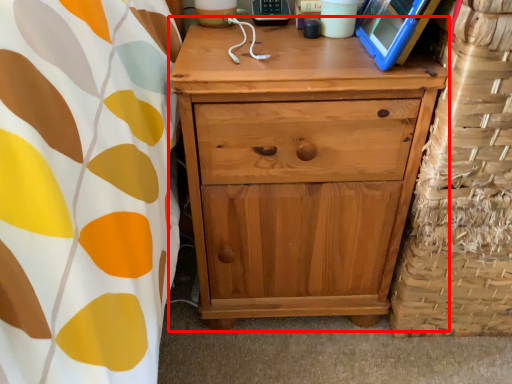
Question: Considering the relative positions of chest of drawers (annotated by the red box) and basket in the image provided, where is chest of drawers (annotated by the red box) located with respect to the staircase?

Choices:
 (A) right
 (B) left

Answer: (B)